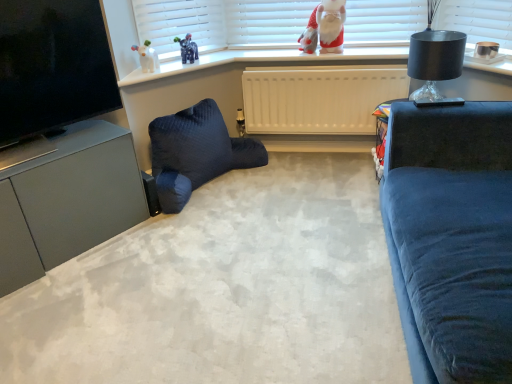
Where is `vacant area located to the right-hand side of dark blue quilted bean bag chair at lower left`? This screenshot has width=512, height=384. vacant area located to the right-hand side of dark blue quilted bean bag chair at lower left is located at coordinates (294, 188).